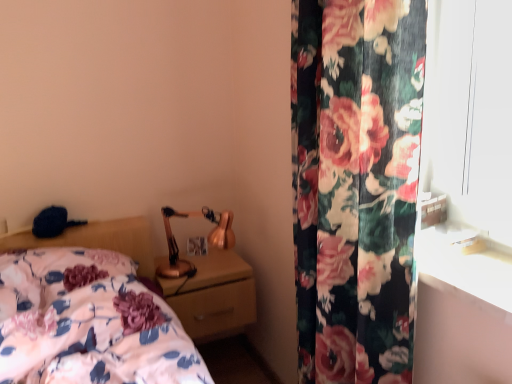
Question: Can you confirm if floral fabric bed at lower left is smaller than matte gold nightstand at center?

Choices:
 (A) no
 (B) yes

Answer: (A)

Question: From the image's perspective, would you say floral fabric bed at lower left is positioned over matte gold nightstand at center?

Choices:
 (A) no
 (B) yes

Answer: (B)

Question: From a real-world perspective, is floral fabric bed at lower left physically above matte gold nightstand at center?

Choices:
 (A) no
 (B) yes

Answer: (B)

Question: Is matte gold nightstand at center at the back of floral fabric bed at lower left?

Choices:
 (A) yes
 (B) no

Answer: (B)

Question: From a real-world perspective, is floral fabric bed at lower left below matte gold nightstand at center?

Choices:
 (A) yes
 (B) no

Answer: (B)

Question: Does floral fabric bed at lower left contain matte gold nightstand at center?

Choices:
 (A) no
 (B) yes

Answer: (A)

Question: Is floral fabric curtain at right facing towards copper metallic table lamp at upper right?

Choices:
 (A) yes
 (B) no

Answer: (B)

Question: Is floral fabric curtain at right outside of copper metallic table lamp at upper right?

Choices:
 (A) no
 (B) yes

Answer: (B)

Question: Would you say floral fabric curtain at right is a long distance from copper metallic table lamp at upper right?

Choices:
 (A) no
 (B) yes

Answer: (A)

Question: Can you confirm if floral fabric curtain at right is wider than copper metallic table lamp at upper right?

Choices:
 (A) no
 (B) yes

Answer: (A)

Question: Is floral fabric curtain at right at the right side of copper metallic table lamp at upper right?

Choices:
 (A) no
 (B) yes

Answer: (B)

Question: Can you confirm if floral fabric curtain at right is thinner than copper metallic table lamp at upper right?

Choices:
 (A) no
 (B) yes

Answer: (B)

Question: Does matte gold nightstand at center have a lesser height compared to floral fabric bed at lower left?

Choices:
 (A) no
 (B) yes

Answer: (A)